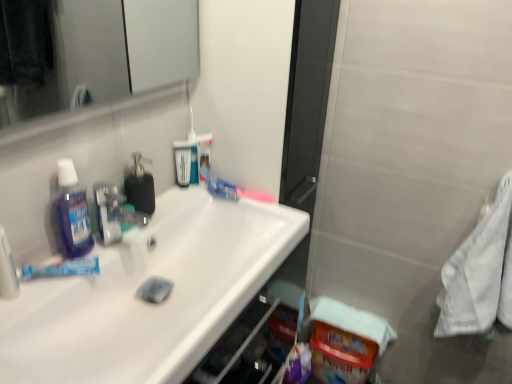
Question: Would you say blue matte toothpaste at left is to the left or to the right of translucent plastic toothbrush at upper center, placed as the second toothbrush when sorted from right to left, in the picture?

Choices:
 (A) right
 (B) left

Answer: (B)

Question: Is blue matte toothpaste at left situated inside translucent plastic toothbrush at upper center, placed as the second toothbrush when sorted from right to left, or outside?

Choices:
 (A) outside
 (B) inside

Answer: (A)

Question: Estimate the real-world distances between objects in this image. Which object is closer to the white glossy sink at upper left?

Choices:
 (A) translucent purple mouthwash at left, marked as the first mouthwash in a left-to-right arrangement
 (B) black rubber soap dispenser at center
 (C) blue matte toothpaste at left
 (D) blue glossy mouthwash at upper center, the 2th mouthwash viewed from the right
 (E) pink plastic toothbrush at upper center, the first toothbrush in the right-to-left sequence

Answer: (C)

Question: Estimate the real-world distances between objects in this image. Which object is farther from the blue matte toothpaste at left?

Choices:
 (A) white textured towel at right
 (B) white glossy sink at upper left
 (C) translucent plastic toothbrush at upper center, which is counted as the 2th toothbrush, starting from the bottom
 (D) translucent purple mouthwash at left, the 1th mouthwash from the front
 (E) blue glossy mouthwash at upper center, which is the 1th mouthwash from back to front

Answer: (A)